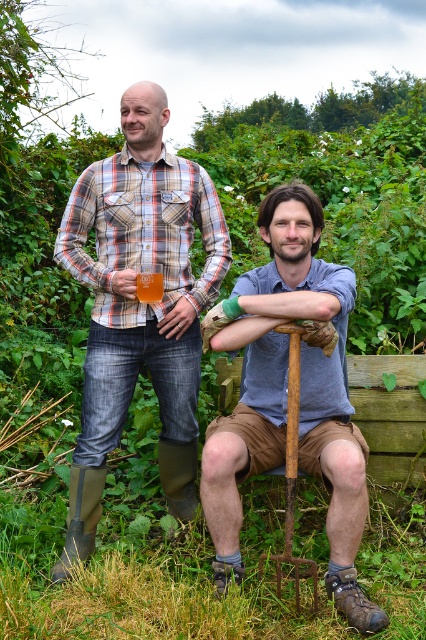
Question: Which point appears farthest from the camera in this image?

Choices:
 (A) (345, 428)
 (B) (195, 476)
 (C) (210, 449)
 (D) (285, 424)

Answer: (B)

Question: Is plaid shirt at upper left above translucent glass cup at center?

Choices:
 (A) no
 (B) yes

Answer: (A)

Question: Is plaid shirt at upper left to the left of rusty metal shovel at center from the viewer's perspective?

Choices:
 (A) no
 (B) yes

Answer: (B)

Question: Among these objects, which one is nearest to the camera?

Choices:
 (A) plaid shirt at left
 (B) blue denim shirt at center

Answer: (B)

Question: Which of these objects is positioned closest to the rusty metal shovel at center?

Choices:
 (A) plaid shirt at upper left
 (B) plaid shirt at left
 (C) translucent glass cup at center
 (D) blue denim shirt at center

Answer: (A)

Question: Can you confirm if blue denim shirt at center is positioned above translucent glass cup at center?

Choices:
 (A) no
 (B) yes

Answer: (A)